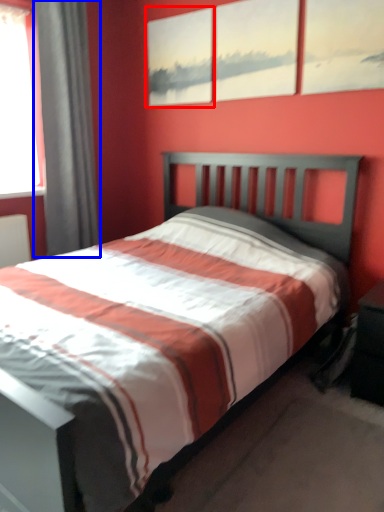
Question: Among these objects, which one is nearest to the camera, picture frame (highlighted by a red box) or curtain (highlighted by a blue box)?

Choices:
 (A) picture frame
 (B) curtain

Answer: (B)